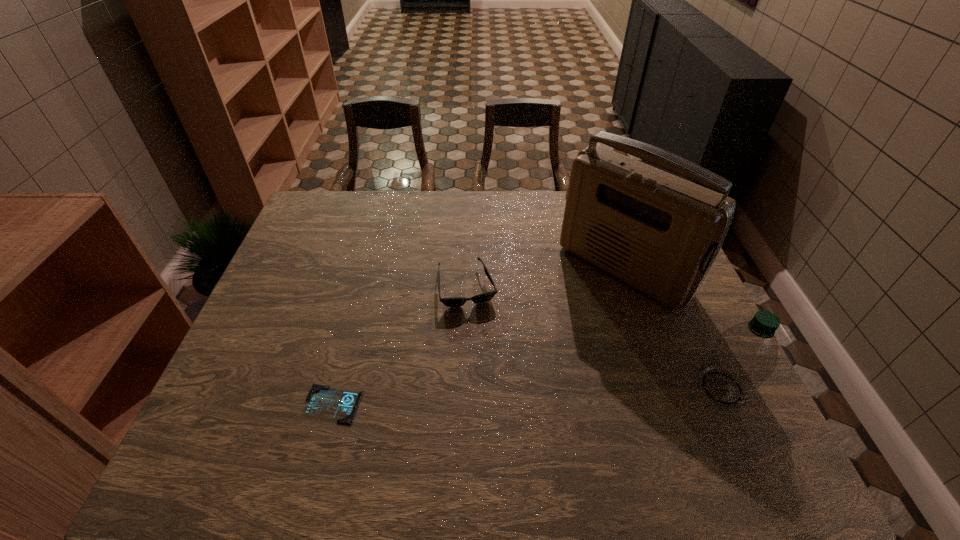
Where is `the leftmost object`? the leftmost object is located at coordinates (322, 401).

Identify the location of the shortest object. [x=322, y=401].

This screenshot has height=540, width=960. I want to click on the third shortest object, so click(x=743, y=356).

This screenshot has height=540, width=960. I want to click on radio receiver, so click(x=659, y=233).

The image size is (960, 540). Identify the location of the second shortest object. (487, 296).

You are a GUI agent. You are given a task and a screenshot of the screen. Output one action in this format:
    pyautogui.click(x=<x>, y=<y>)
    Task: Click on the sunglasses
    Image resolution: width=960 pixels, height=540 pixels.
    Given the screenshot: What is the action you would take?
    pyautogui.click(x=487, y=296)

Identify the location of free spot located on the back of the shortest object. The image size is (960, 540). (354, 325).

Where is `vacant region located 0.270m on the left of the water bottle`? vacant region located 0.270m on the left of the water bottle is located at coordinates (578, 388).

The height and width of the screenshot is (540, 960). Find the location of `free region located on the front-facing side of the radio receiver`. free region located on the front-facing side of the radio receiver is located at coordinates (555, 331).

Locate an element on the screen. The width and height of the screenshot is (960, 540). free spot located 0.250m on the front-facing side of the radio receiver is located at coordinates (530, 354).